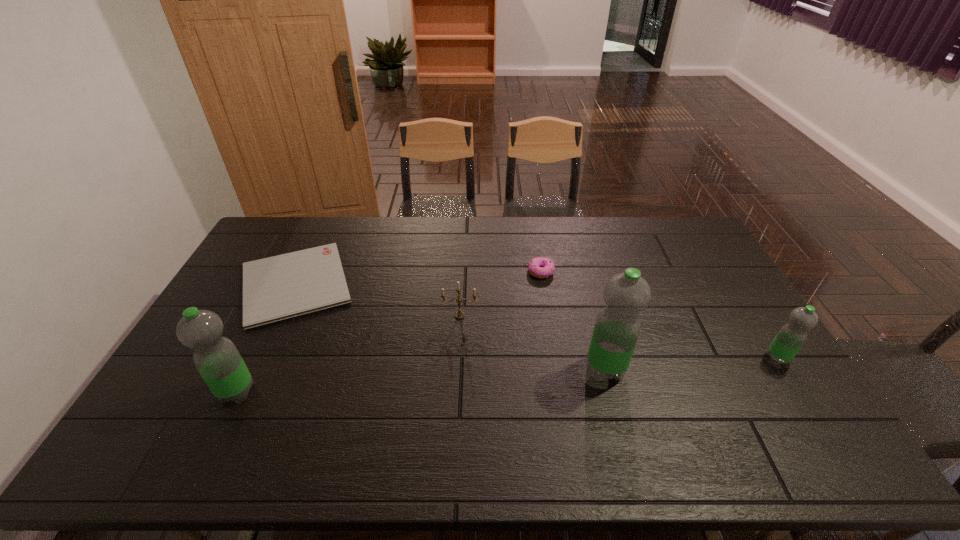
Please point a space for a new water_bottle to maintain equal intervals. Please provide its 2D coordinates. Your answer should be formatted as a tuple, i.e. [(x, y)], where the tuple contains the x and y coordinates of a point satisfying the conditions above.

[(425, 380)]